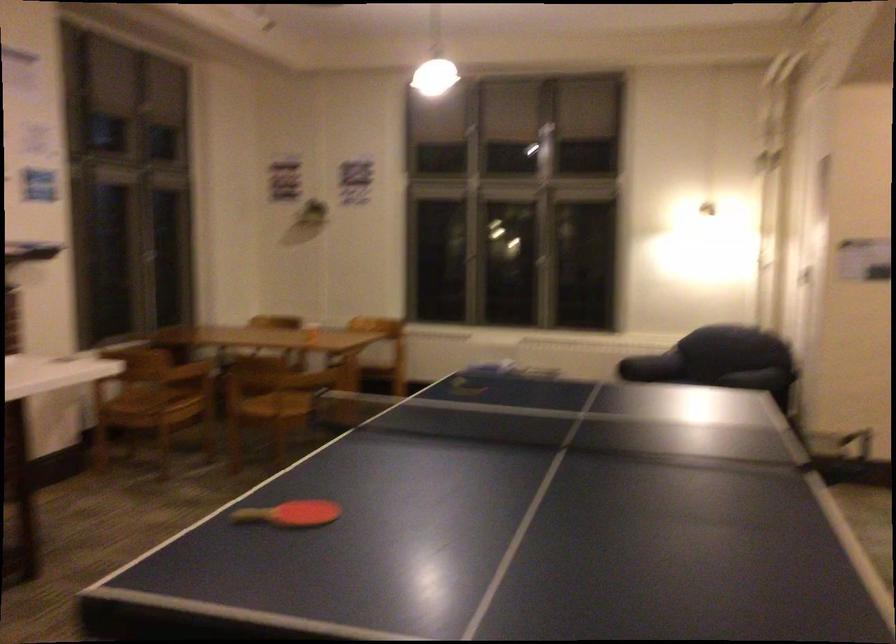
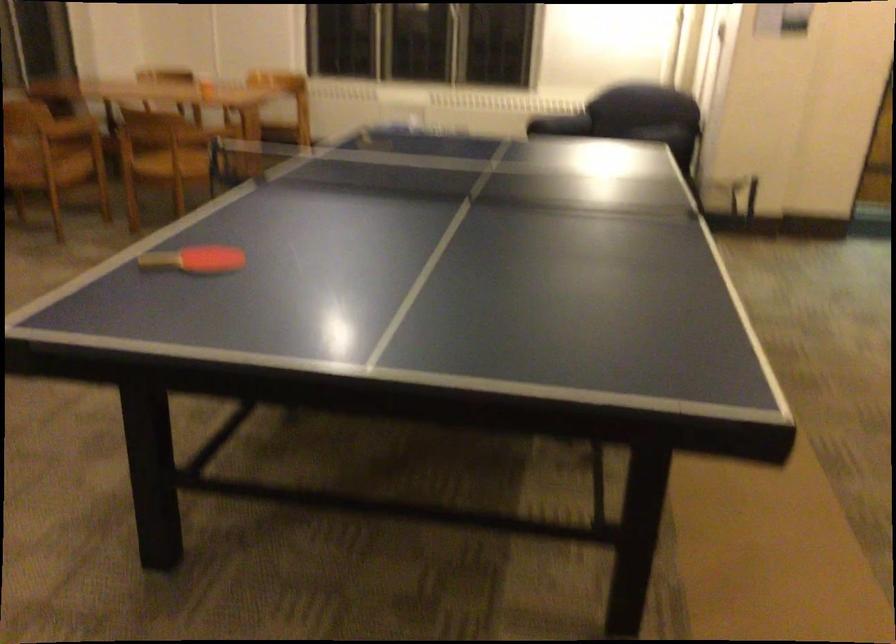
The point at (288, 516) is marked in the first image. Where is the corresponding point in the second image?

(194, 259)